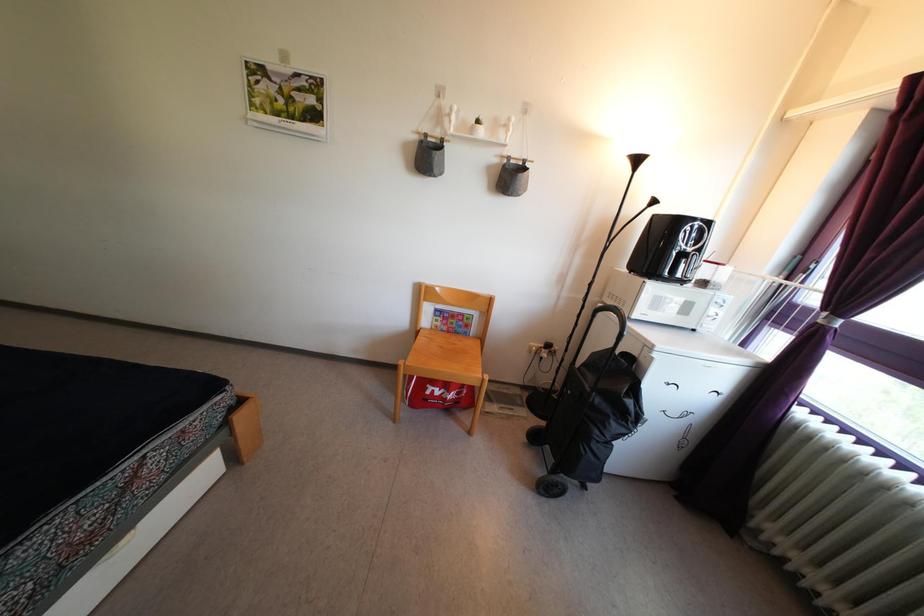
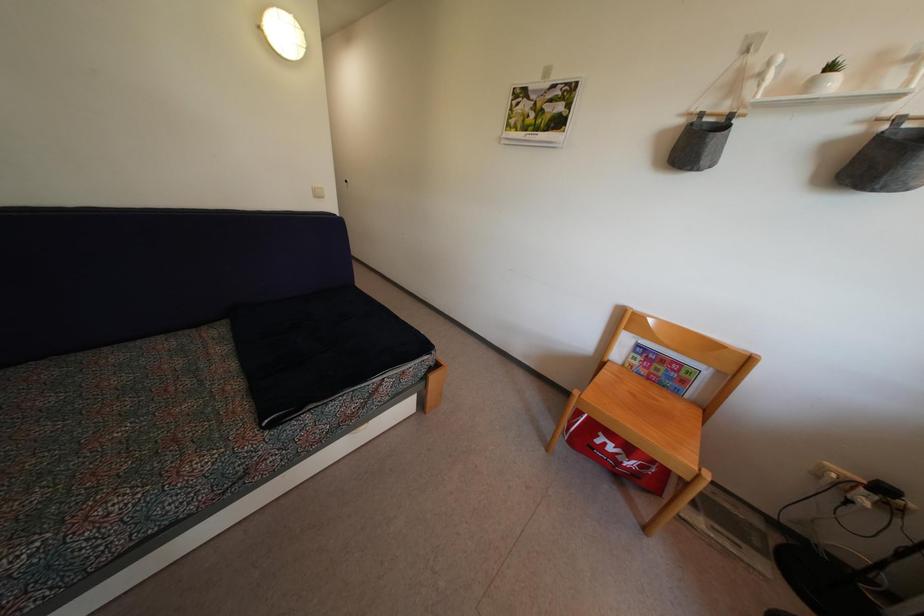
Question: Based on the continuous images, in which direction is the camera rotating? Reply with the corresponding letter.

Choices:
 (A) Left
 (B) Right
 (C) Up
 (D) Down

Answer: (A)